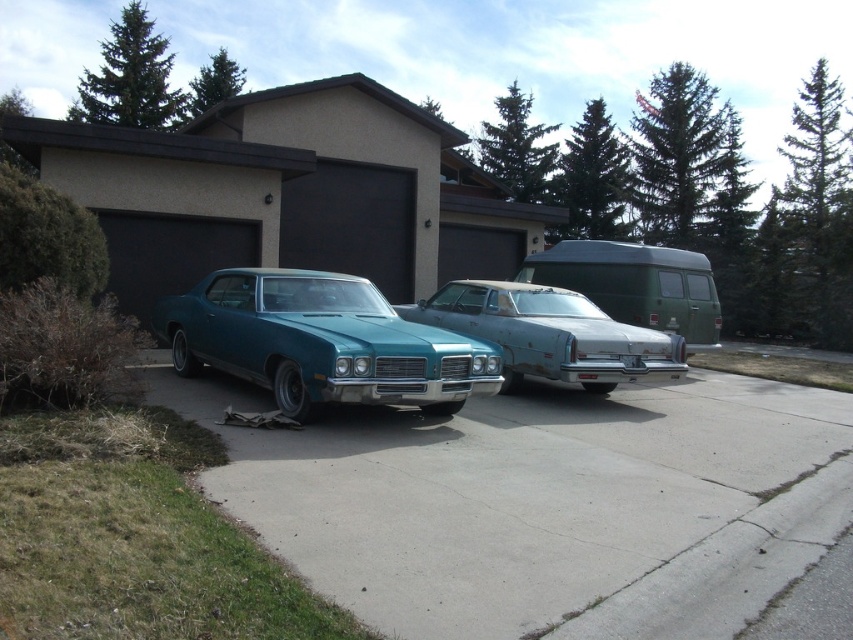
Question: Which object is positioned farthest from the green matte van at center?

Choices:
 (A) teal glossy car at center
 (B) concrete at center
 (C) silver metallic sedan at center

Answer: (A)

Question: Considering the relative positions of silver metallic sedan at center and green matte van at center in the image provided, where is silver metallic sedan at center located with respect to green matte van at center?

Choices:
 (A) above
 (B) below

Answer: (B)

Question: Is teal glossy car at center closer to the viewer compared to green matte van at center?

Choices:
 (A) no
 (B) yes

Answer: (B)

Question: Which object is positioned closest to the concrete at center?

Choices:
 (A) teal glossy car at center
 (B) green matte van at center

Answer: (A)

Question: Is teal glossy car at center further to the viewer compared to green matte van at center?

Choices:
 (A) yes
 (B) no

Answer: (B)

Question: Which object is the closest to the silver metallic sedan at center?

Choices:
 (A) teal glossy car at center
 (B) concrete at center

Answer: (B)